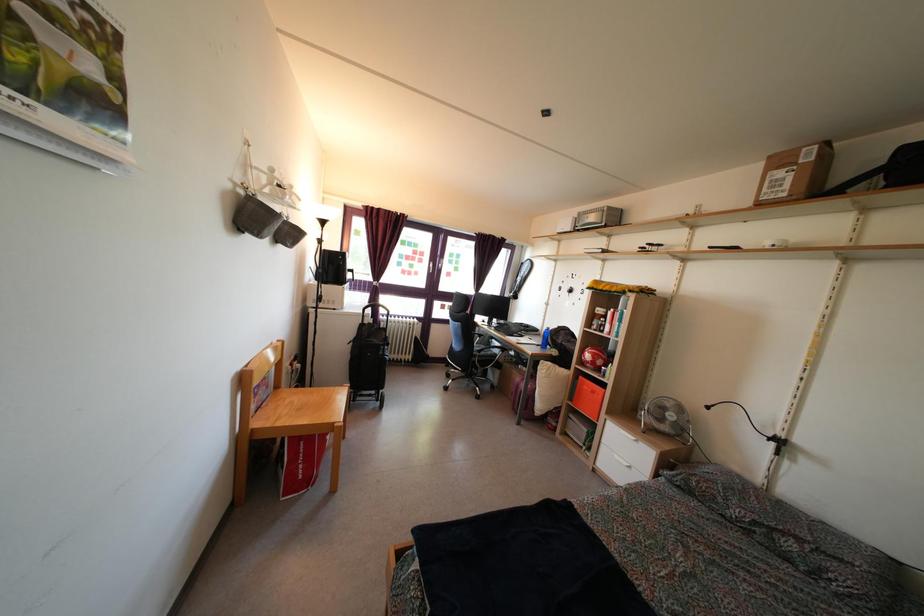
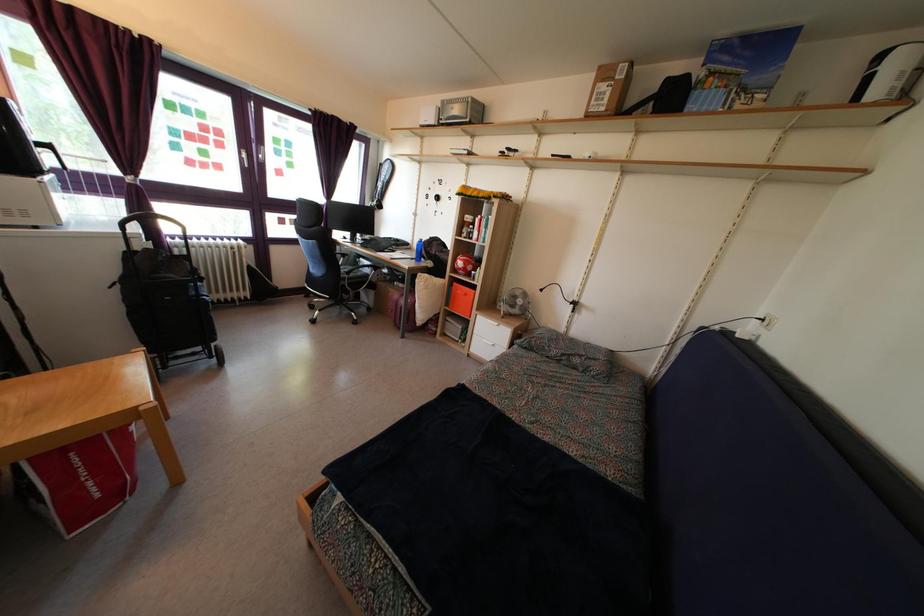
In the second image, find the point that corresponds to [602,320] in the first image.

(470, 227)